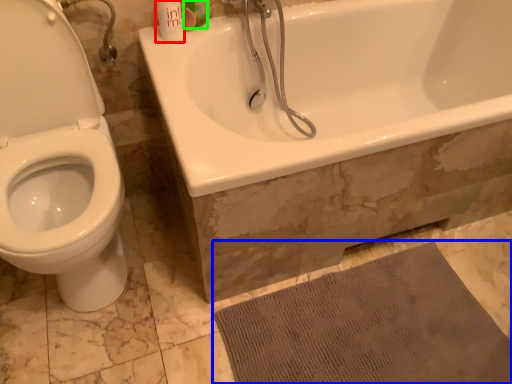
Question: Estimate the real-world distances between objects in this image. Which object is farther from mouthwash (highlighted by a red box), bath mat (highlighted by a blue box) or mouthwash (highlighted by a green box)?

Choices:
 (A) bath mat
 (B) mouthwash

Answer: (A)